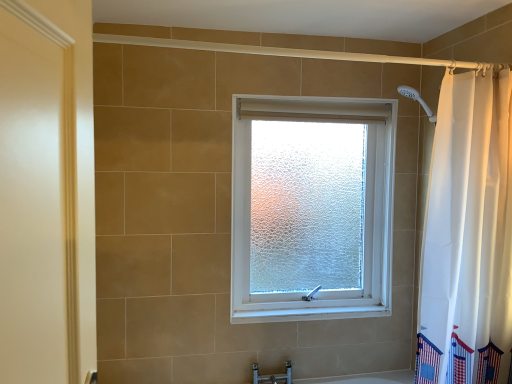
Question: Is white fabric curtain at right bigger than frosted glass window at center?

Choices:
 (A) no
 (B) yes

Answer: (A)

Question: Is white fabric curtain at right at the left side of frosted glass window at center?

Choices:
 (A) yes
 (B) no

Answer: (B)

Question: From the image's perspective, does white fabric curtain at right appear higher than frosted glass window at center?

Choices:
 (A) yes
 (B) no

Answer: (A)

Question: Considering the relative positions of white fabric curtain at right and frosted glass window at center in the image provided, is white fabric curtain at right in front of frosted glass window at center?

Choices:
 (A) no
 (B) yes

Answer: (B)

Question: Is white fabric curtain at right not close to frosted glass window at center?

Choices:
 (A) yes
 (B) no

Answer: (B)

Question: Is the position of white fabric curtain at right more distant than that of frosted glass window at center?

Choices:
 (A) yes
 (B) no

Answer: (B)

Question: Can you confirm if matte silver faucet at lower center is smaller than white fabric curtain at right?

Choices:
 (A) yes
 (B) no

Answer: (A)

Question: Is matte silver faucet at lower center aimed at white fabric curtain at right?

Choices:
 (A) no
 (B) yes

Answer: (A)

Question: Is matte silver faucet at lower center positioned with its back to white fabric curtain at right?

Choices:
 (A) yes
 (B) no

Answer: (B)

Question: Considering the relative positions of matte silver faucet at lower center and white fabric curtain at right in the image provided, is matte silver faucet at lower center to the right of white fabric curtain at right from the viewer's perspective?

Choices:
 (A) yes
 (B) no

Answer: (B)

Question: Considering the relative positions of matte silver faucet at lower center and white fabric curtain at right in the image provided, is matte silver faucet at lower center in front of white fabric curtain at right?

Choices:
 (A) yes
 (B) no

Answer: (B)

Question: Is matte silver faucet at lower center further to camera compared to white fabric curtain at right?

Choices:
 (A) yes
 (B) no

Answer: (A)

Question: Is frosted glass window at center behind white fabric curtain at right?

Choices:
 (A) yes
 (B) no

Answer: (A)